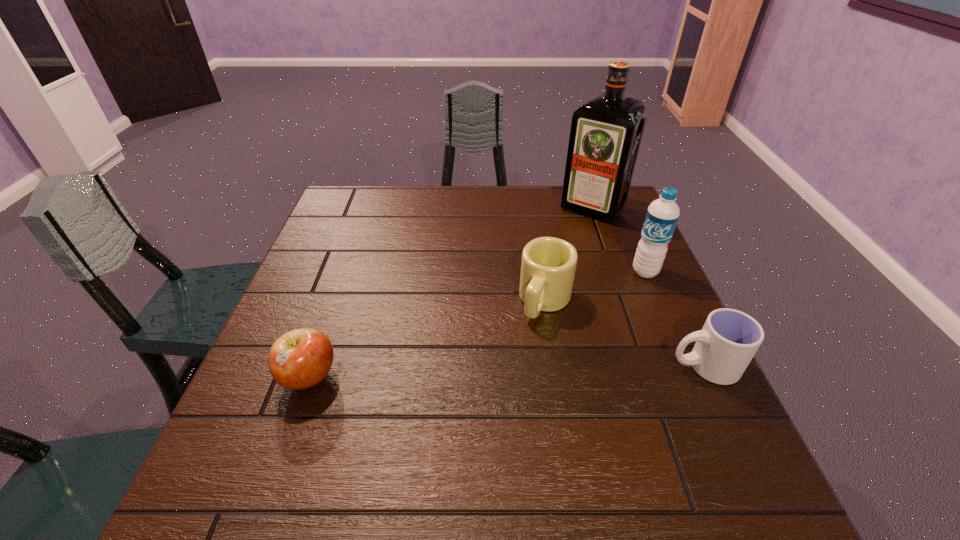
Image resolution: width=960 pixels, height=540 pixels. I want to click on the leftmost object, so click(x=299, y=359).

At what (x,y) coordinates should I click in order to perform the action: click on cup. Please return your answer as a coordinate pair (x, y). Looking at the image, I should click on (729, 339).

This screenshot has width=960, height=540. Find the location of `the second object from left to right`. the second object from left to right is located at coordinates (548, 265).

At what (x,y) coordinates should I click in order to perform the action: click on water bottle. Please return your answer as a coordinate pair (x, y). The image size is (960, 540). Looking at the image, I should click on (662, 215).

Where is `the tallest object`? This screenshot has height=540, width=960. the tallest object is located at coordinates (606, 131).

Where is `liquor`? The height and width of the screenshot is (540, 960). liquor is located at coordinates (606, 131).

Locate an element on the screen. The height and width of the screenshot is (540, 960). vacant region located on the front of the leftmost object is located at coordinates 286,442.

Where is `blank area located with the handle on the side of the cup`? This screenshot has height=540, width=960. blank area located with the handle on the side of the cup is located at coordinates (524, 366).

The image size is (960, 540). What are the coordinates of `vacant space located with the handle on the side of the cup` in the screenshot? It's located at (515, 366).

You are a GUI agent. You are given a task and a screenshot of the screen. Output one action in this format:
    pyautogui.click(x=<x>, y=<y>)
    Task: Click on the vacant space located 0.050m with the handle on the side of the cup
    
    Given the screenshot: What is the action you would take?
    pyautogui.click(x=645, y=366)